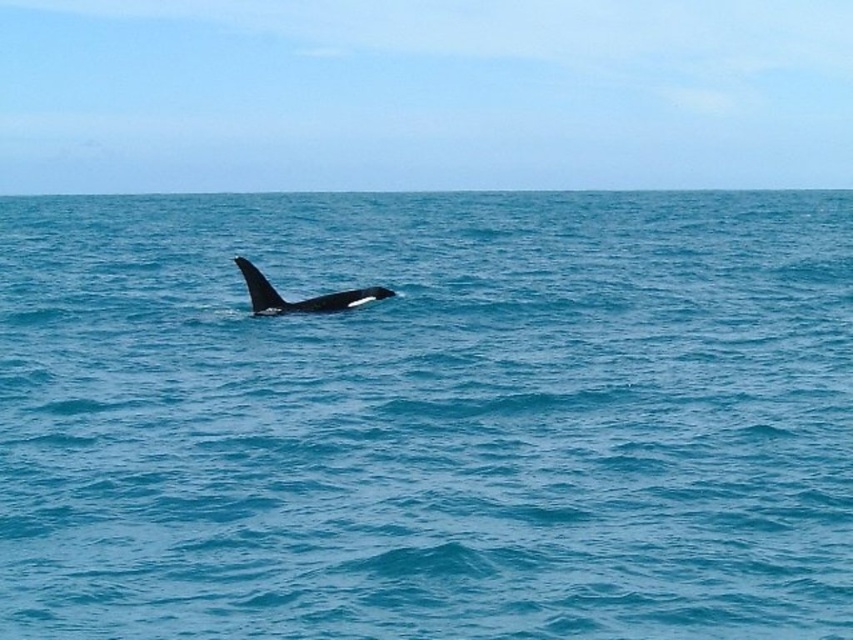
Who is more distant from viewer, (805, 628) or (291, 307)?

The point (291, 307) is behind.

Which of these two, blue water at center or black smooth whale at center, stands taller?

With more height is blue water at center.

Between point (564, 627) and point (274, 292), which one is positioned in front?

Point (564, 627)

Identify the location of blue water at center. This screenshot has width=853, height=640. (427, 417).